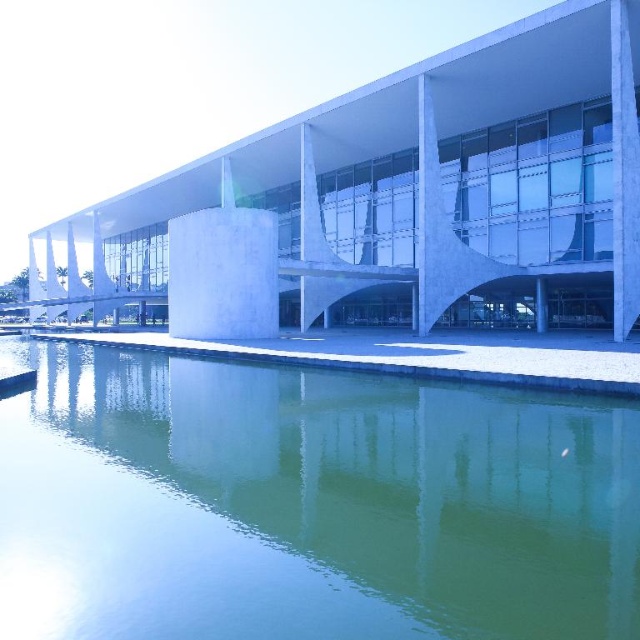
Does green reflective water at center have a lesser height compared to white concrete building at center?

Correct, green reflective water at center is not as tall as white concrete building at center.

Can you confirm if green reflective water at center is taller than white concrete building at center?

No.

The image size is (640, 640). I want to click on green reflective water at center, so click(308, 504).

Identify the location of green reflective water at center. This screenshot has height=640, width=640. (308, 504).